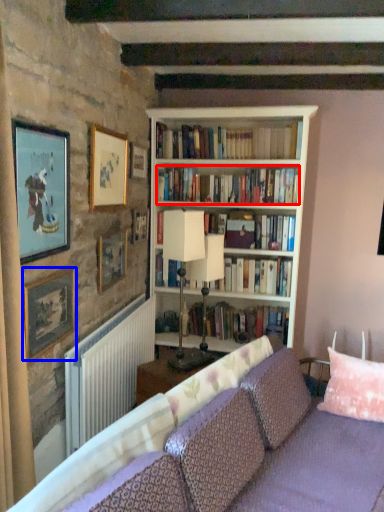
Question: Among these objects, which one is nearest to the camera, book (highlighted by a red box) or picture frame (highlighted by a blue box)?

Choices:
 (A) book
 (B) picture frame

Answer: (B)